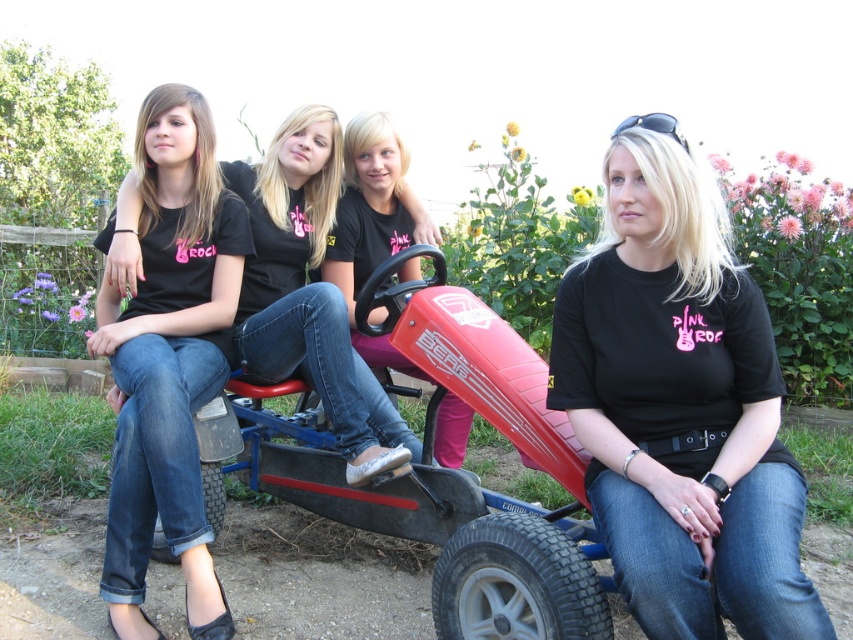
You are standing at the point labeled point (200,93) and want to move to the point labeled point (712,589). Which direction should you move to reach your destination?

You should move forward because point (712,589) is in front of point (200,93).